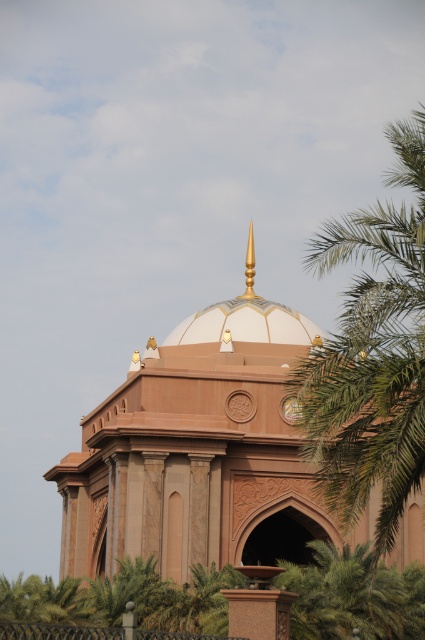
Question: Which of the following is the farthest from the observer?

Choices:
 (A) tap(388, 488)
 (B) tap(155, 440)

Answer: (B)

Question: Which point appears farthest from the camera in this image?

Choices:
 (A) (337, 400)
 (B) (241, 541)

Answer: (B)

Question: Can you confirm if matte pink stone dome at center is smaller than green leafy palm tree at right?

Choices:
 (A) no
 (B) yes

Answer: (B)

Question: Among these points, which one is farthest from the camera?

Choices:
 (A) (399, 502)
 (B) (269, 492)

Answer: (B)

Question: Is matte pink stone dome at center thinner than green leafy palm tree at right?

Choices:
 (A) no
 (B) yes

Answer: (A)

Question: Does matte pink stone dome at center lie in front of green leafy palm tree at right?

Choices:
 (A) no
 (B) yes

Answer: (A)